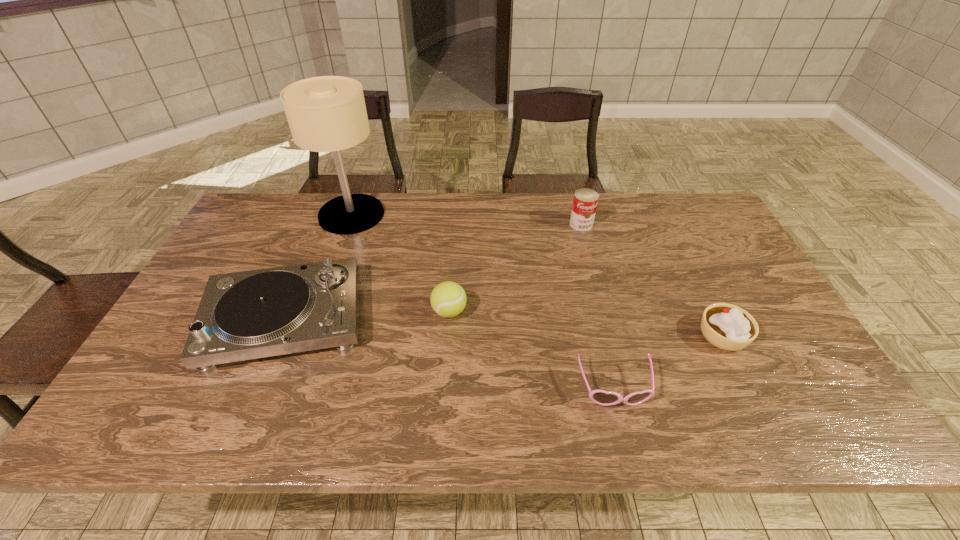
Where is `the tallest object`? Image resolution: width=960 pixels, height=540 pixels. the tallest object is located at coordinates (326, 113).

You are a GUI agent. You are given a task and a screenshot of the screen. Output one action in this format:
    pyautogui.click(x=<x>, y=<y>)
    Task: Click on the fifth shortest object
    The width and height of the screenshot is (960, 540).
    Given the screenshot: What is the action you would take?
    pyautogui.click(x=585, y=201)

In order to click on record player in this screenshot , I will do `click(253, 314)`.

Where is `tennis ball`? This screenshot has width=960, height=540. tennis ball is located at coordinates (448, 299).

The image size is (960, 540). Identify the location of whipped cream. (726, 326).

The width and height of the screenshot is (960, 540). I want to click on the shortest object, so click(601, 397).

Where is `free space located 0.070m on the front of the tallest object`? The image size is (960, 540). free space located 0.070m on the front of the tallest object is located at coordinates (339, 249).

Locate an element on the screen. This screenshot has width=960, height=540. free space located 0.320m on the front label of the second tallest object is located at coordinates (603, 305).

The width and height of the screenshot is (960, 540). Find the location of `vacant space located 0.050m on the back of the record player`. vacant space located 0.050m on the back of the record player is located at coordinates (308, 262).

The image size is (960, 540). Find the location of `free point located on the left of the third object from left to right`. free point located on the left of the third object from left to right is located at coordinates (379, 312).